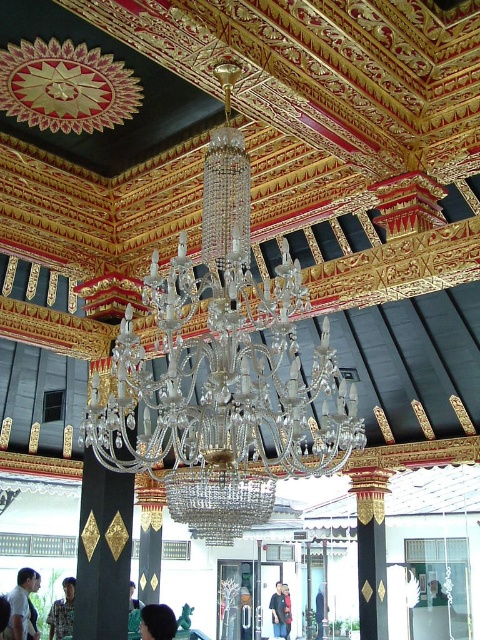
Is blue velvet dress at center shorter than dark blue shirt at center?

Yes, blue velvet dress at center is shorter than dark blue shirt at center.

Between blue velvet dress at center and dark blue shirt at center, which one appears on the left side from the viewer's perspective?

dark blue shirt at center

Locate an element on the screen. This screenshot has height=640, width=480. blue velvet dress at center is located at coordinates (320, 611).

From the picture: Between camouflage uniform at lower left and green fabric person at lower center, which one has less height?

camouflage uniform at lower left is shorter.

What do you see at coordinates (62, 611) in the screenshot? This screenshot has height=640, width=480. I see `camouflage uniform at lower left` at bounding box center [62, 611].

Where is `camouflage uniform at lower left`? The height and width of the screenshot is (640, 480). camouflage uniform at lower left is located at coordinates (62, 611).

You are a GUI agent. You are given a task and a screenshot of the screen. Output one action in this format:
    pyautogui.click(x=<x>, y=<y>)
    Task: Click on the camouflage uniform at lower left
    This screenshot has width=480, height=640.
    Given the screenshot: What is the action you would take?
    pyautogui.click(x=62, y=611)

Consider the image. Who is shorter, white fabric shirt at lower left or dark brown hair at center?

Standing shorter between the two is dark brown hair at center.

Who is taller, white fabric shirt at lower left or dark brown hair at center?

white fabric shirt at lower left is taller.

The image size is (480, 640). Describe the element at coordinates (22, 608) in the screenshot. I see `white fabric shirt at lower left` at that location.

Find the location of a particular element. The width and height of the screenshot is (480, 640). white fabric shirt at lower left is located at coordinates (22, 608).